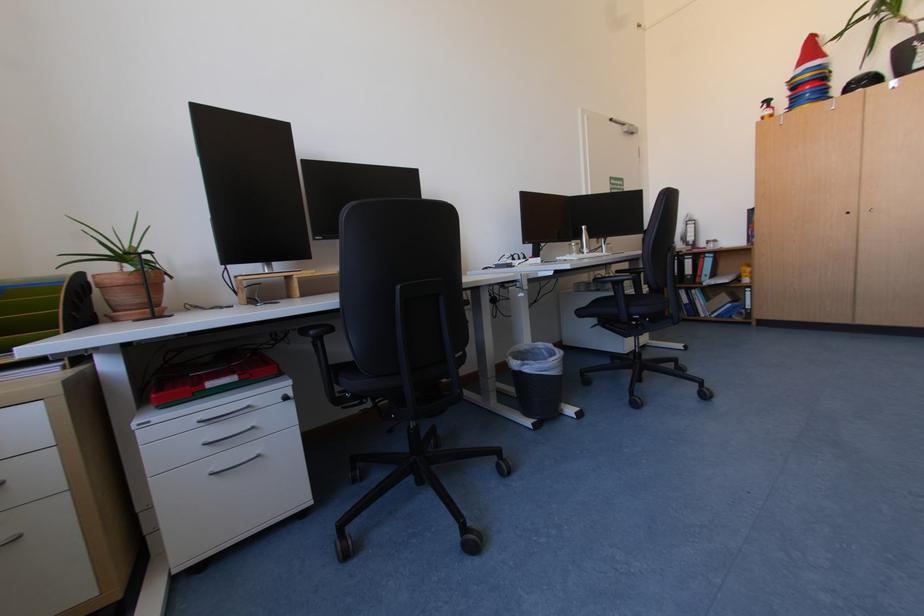
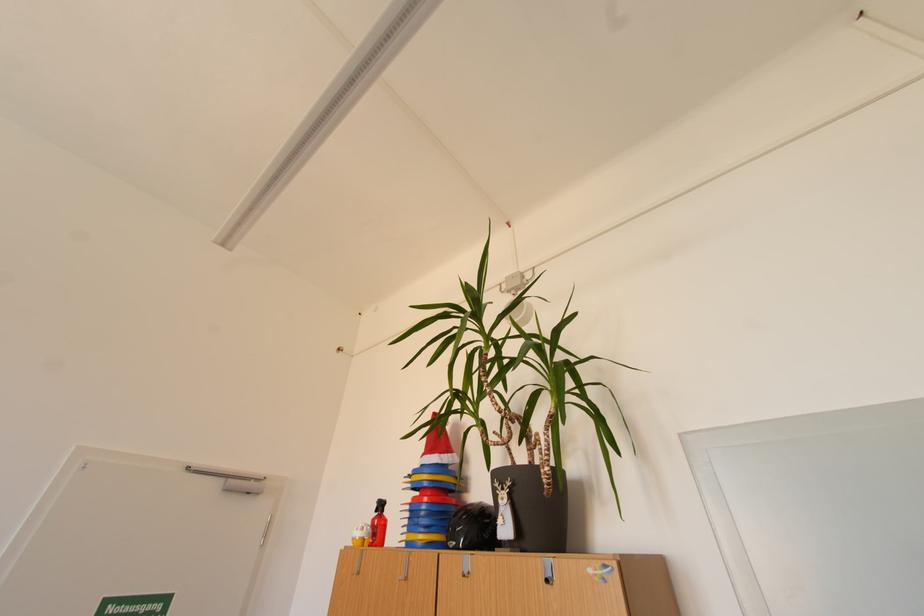
In the second image, find the point that corresponds to (x=816, y=95) in the first image.

(431, 514)